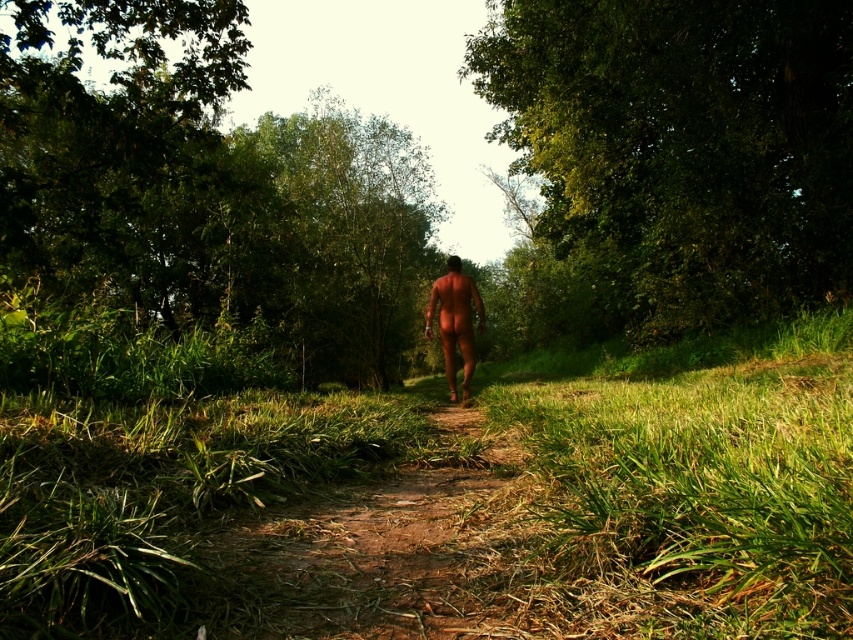
Is dirt path at center further to camera compared to smooth skin man at center?

No, dirt path at center is in front of smooth skin man at center.

Where is `dirt path at center`? dirt path at center is located at coordinates (368, 548).

Is the position of green leafy tree at center less distant than that of dirt path at center?

No, green leafy tree at center is behind dirt path at center.

Does point (73, 195) come behind point (354, 532)?

Yes, point (73, 195) is behind point (354, 532).

I want to click on green leafy tree at center, so click(x=206, y=186).

Is green leafy tree at upper right to the left of dirt path at center from the viewer's perspective?

Incorrect, green leafy tree at upper right is not on the left side of dirt path at center.

Is green leafy tree at upper right to the right of dirt path at center from the viewer's perspective?

Correct, you'll find green leafy tree at upper right to the right of dirt path at center.

Who is more forward, (698,208) or (351,548)?

Point (351,548)

You are a GUI agent. You are given a task and a screenshot of the screen. Output one action in this format:
    pyautogui.click(x=<x>, y=<y>)
    Task: Click on the green leafy tree at upper right
    This screenshot has width=853, height=640.
    Given the screenshot: What is the action you would take?
    pyautogui.click(x=677, y=154)